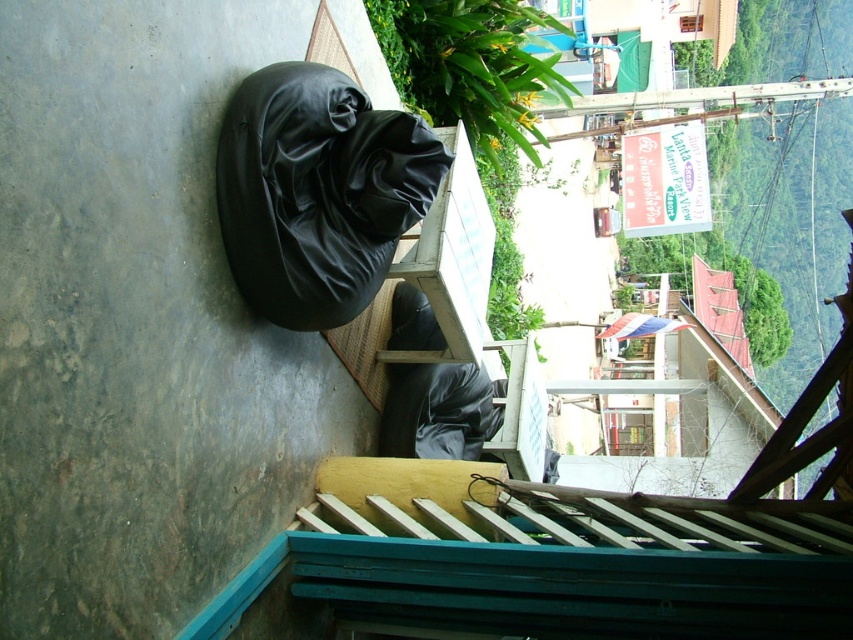
Which is more to the left, black leather beanbag at upper left or matte black beanbag at center?

black leather beanbag at upper left

Based on the photo, who is positioned more to the right, black leather beanbag at upper left or matte black beanbag at center?

From the viewer's perspective, matte black beanbag at center appears more on the right side.

Does point (380, 189) come in front of point (427, 444)?

Yes, point (380, 189) is in front of point (427, 444).

The width and height of the screenshot is (853, 640). I want to click on black leather beanbag at upper left, so click(x=317, y=192).